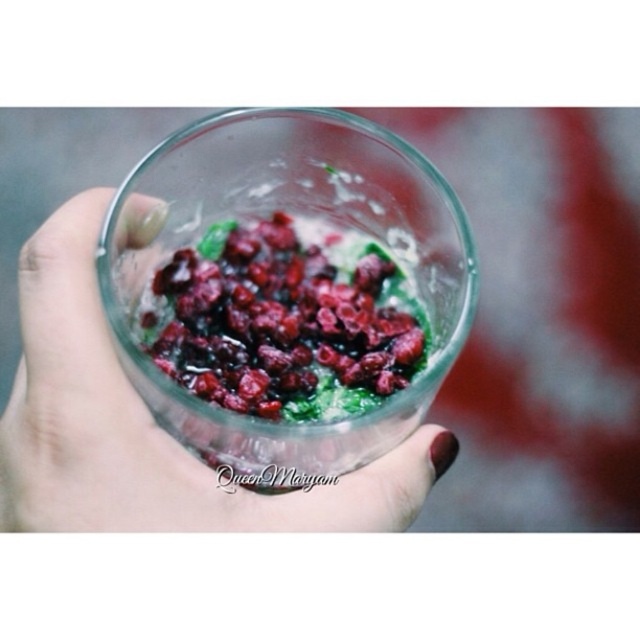
Is the position of clear glass cup at center more distant than that of glossy red berries at center?

No, it is in front of glossy red berries at center.

Does clear glass cup at center appear over glossy red berries at center?

Incorrect, clear glass cup at center is not positioned above glossy red berries at center.

Does point (42, 440) come farther from viewer compared to point (353, 316)?

No, (42, 440) is in front of (353, 316).

Where is `clear glass cup at center`? This screenshot has height=640, width=640. clear glass cup at center is located at coordinates (147, 426).